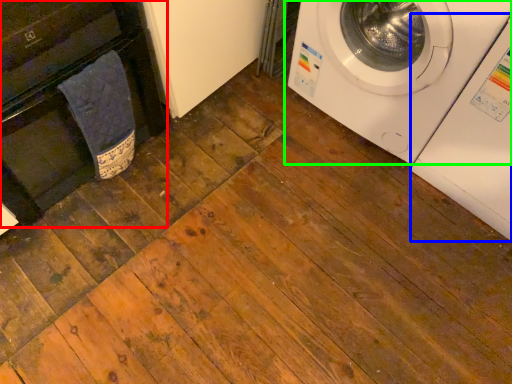
Question: Based on their relative distances, which object is farther from dish washer (highlighted by a red box)? Choose from washing machine (highlighted by a blue box) and washing machine (highlighted by a green box).

Choices:
 (A) washing machine
 (B) washing machine

Answer: (A)